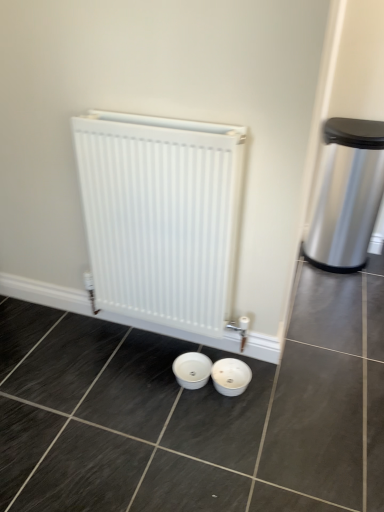
Question: Is polished stainless steel trash can at right at the right side of white matte radiator at center?

Choices:
 (A) yes
 (B) no

Answer: (A)

Question: Is polished stainless steel trash can at right at the left side of white matte radiator at center?

Choices:
 (A) yes
 (B) no

Answer: (B)

Question: Is polished stainless steel trash can at right aimed at white matte radiator at center?

Choices:
 (A) yes
 (B) no

Answer: (B)

Question: Is polished stainless steel trash can at right bigger than white matte radiator at center?

Choices:
 (A) no
 (B) yes

Answer: (B)

Question: Can white matte radiator at center be found inside polished stainless steel trash can at right?

Choices:
 (A) no
 (B) yes

Answer: (A)

Question: Is white glossy basin at center wider or thinner than white matte radiator at center?

Choices:
 (A) thin
 (B) wide

Answer: (B)

Question: Does point (221, 359) appear closer or farther from the camera than point (112, 270)?

Choices:
 (A) closer
 (B) farther

Answer: (B)

Question: From the image's perspective, relative to white matte radiator at center, is white glossy basin at center above or below?

Choices:
 (A) below
 (B) above

Answer: (A)

Question: Is white glossy basin at center spatially inside white matte radiator at center, or outside of it?

Choices:
 (A) inside
 (B) outside

Answer: (B)

Question: Is point (107, 247) closer or farther from the camera than point (233, 376)?

Choices:
 (A) farther
 (B) closer

Answer: (B)

Question: From a real-world perspective, is white matte radiator at center above or below white glossy basin at center?

Choices:
 (A) above
 (B) below

Answer: (A)

Question: From the image's perspective, is white matte radiator at center above or below white glossy basin at center?

Choices:
 (A) above
 (B) below

Answer: (A)

Question: Based on their sizes in the image, would you say white matte radiator at center is bigger or smaller than white glossy basin at center?

Choices:
 (A) small
 (B) big

Answer: (B)

Question: From a real-world perspective, is polished stainless steel trash can at right physically located above or below white glossy basin at center?

Choices:
 (A) below
 (B) above

Answer: (B)

Question: Considering their positions, is polished stainless steel trash can at right located in front of or behind white glossy basin at center?

Choices:
 (A) behind
 (B) front

Answer: (A)